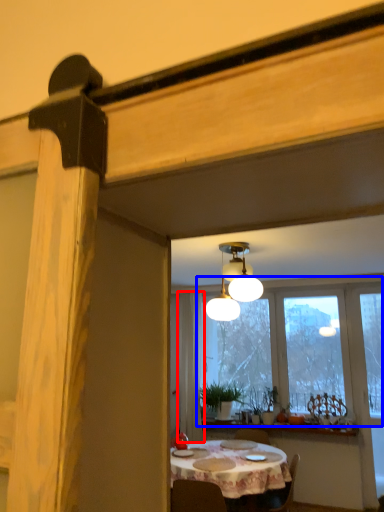
Question: Which point is further to the camera, curtain (highlighted by a red box) or window (highlighted by a blue box)?

Choices:
 (A) curtain
 (B) window

Answer: (A)